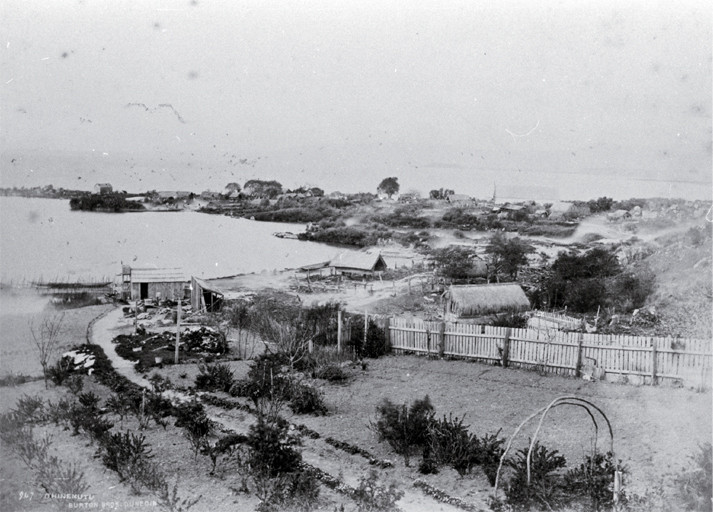
This screenshot has width=713, height=512. I want to click on plant, so click(458, 449).